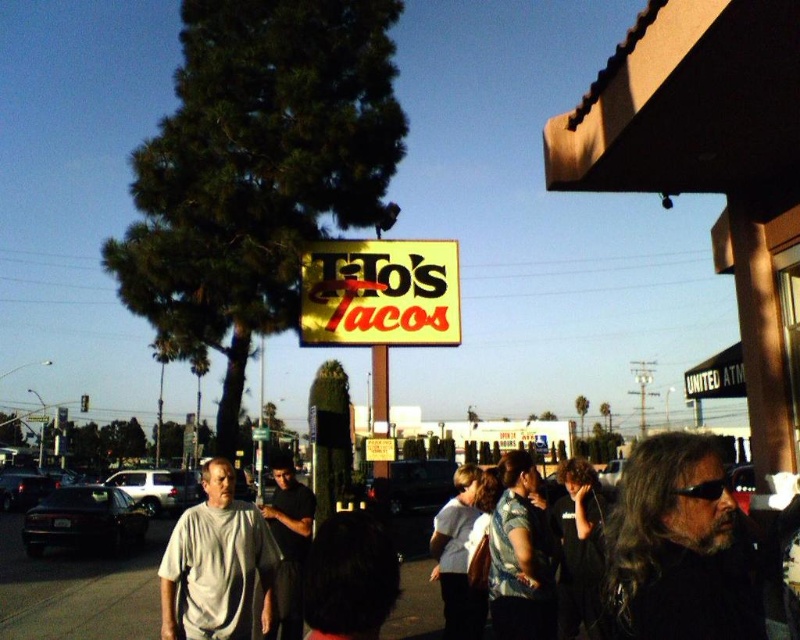
Question: Is white matte shirt at center to the right of dark gray shirt at center from the viewer's perspective?

Choices:
 (A) no
 (B) yes

Answer: (A)

Question: Is dark brown hair at center above dark gray shirt at center?

Choices:
 (A) yes
 (B) no

Answer: (A)

Question: Which point is farther to the camera?

Choices:
 (A) (436, 300)
 (B) (652, 614)
 (C) (225, 624)
 (D) (292, 598)

Answer: (A)

Question: Which of the following is the farthest from the observer?

Choices:
 (A) (276, 598)
 (B) (370, 321)
 (C) (244, 600)

Answer: (B)

Question: Which point is farther from the camera taking this photo?

Choices:
 (A) (620, 602)
 (B) (285, 566)
 (C) (306, 323)

Answer: (C)

Question: Does dark brown hair at center appear over dark gray shirt at center?

Choices:
 (A) yes
 (B) no

Answer: (A)